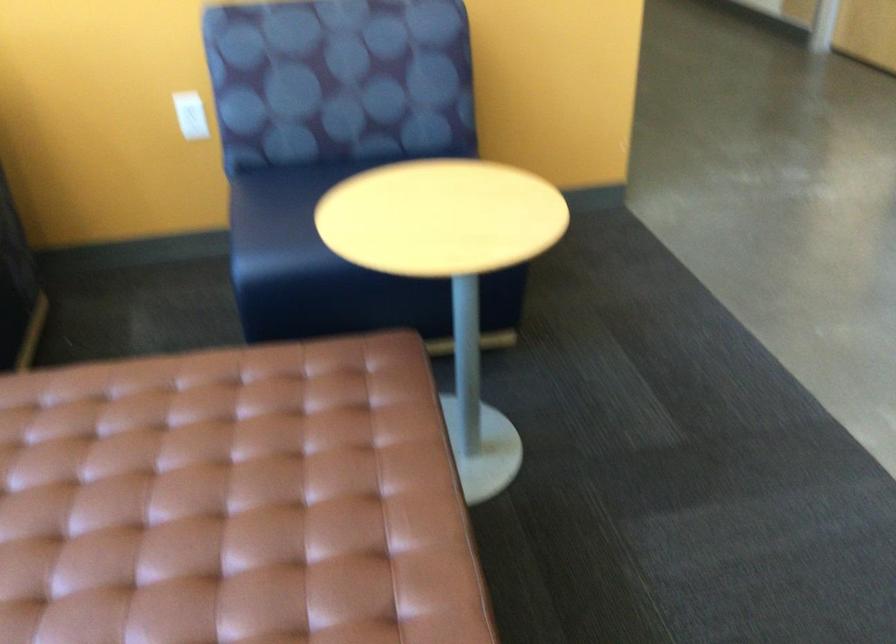
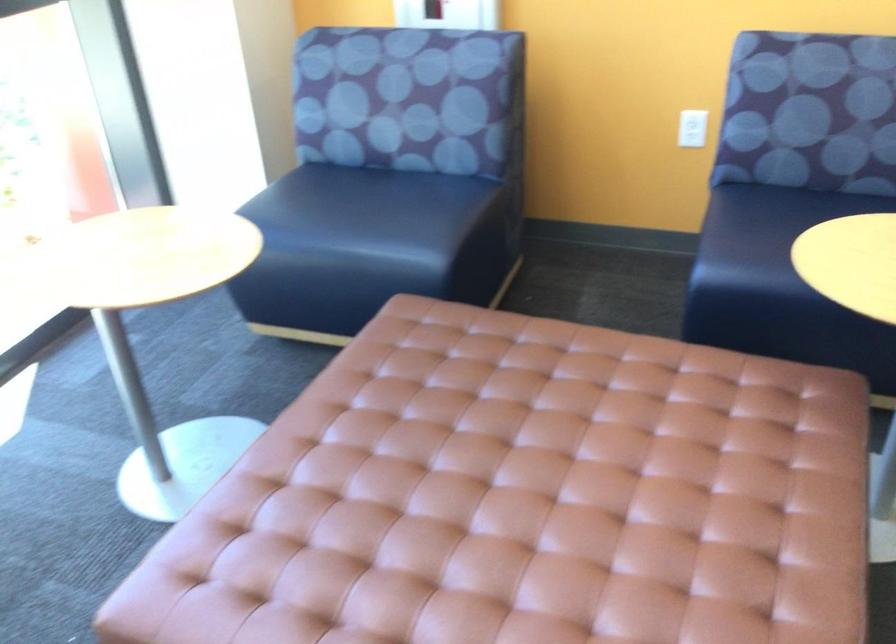
Question: The first image is from the beginning of the video and the second image is from the end. How did the camera likely rotate when shooting the video?

Choices:
 (A) Left
 (B) Right
 (C) Up
 (D) Down

Answer: (A)